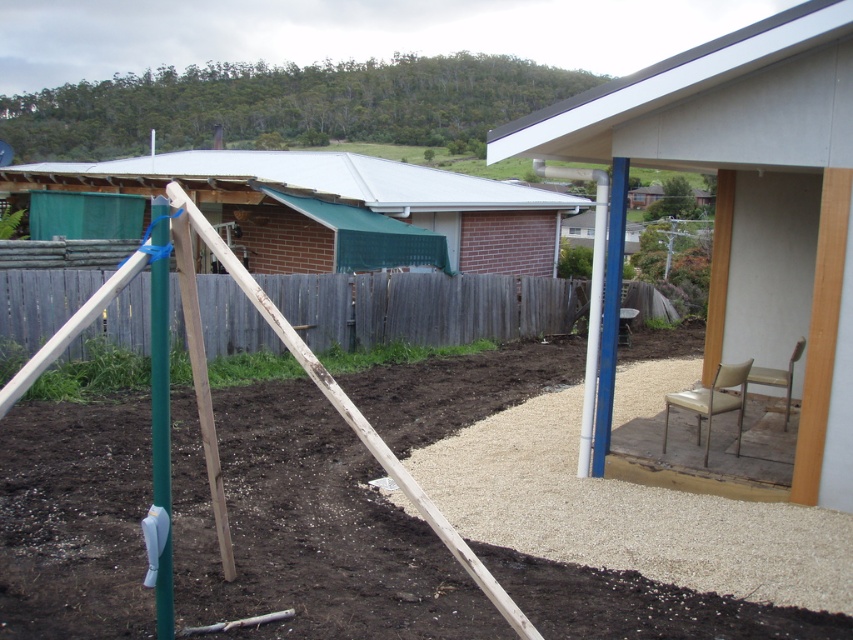
Based on the photo, does brown gravel at lower center appear over white plastic pole at right?

Incorrect, brown gravel at lower center is not positioned above white plastic pole at right.

Is brown gravel at lower center below white plastic pole at right?

Indeed, brown gravel at lower center is positioned under white plastic pole at right.

Is point (173, 563) farther from camera compared to point (579, 468)?

No, (173, 563) is closer to viewer.

Where is `brown gravel at lower center`? brown gravel at lower center is located at coordinates (306, 529).

The width and height of the screenshot is (853, 640). What do you see at coordinates (160, 353) in the screenshot?
I see `green matte pole at left` at bounding box center [160, 353].

Between point (167, 394) and point (709, 396), which one is positioned in front?

Point (167, 394)

Image resolution: width=853 pixels, height=640 pixels. I want to click on green matte pole at left, so click(x=160, y=353).

Which of these two, metal/brick hut at upper left or leather-like beige chair at lower right, stands taller?

With more height is metal/brick hut at upper left.

Can you confirm if metal/brick hut at upper left is wider than leather-like beige chair at lower right?

Yes.

Is point (248, 198) positioned behind point (717, 371)?

That is True.

Identify the location of metal/brick hut at upper left. The height and width of the screenshot is (640, 853). (322, 209).